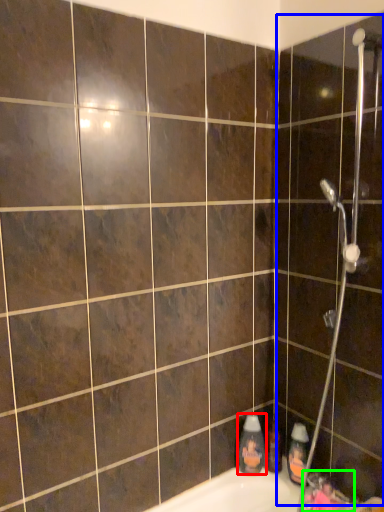
Question: Based on their relative distances, which object is farther from cleaning product (highlighted by a red box)? Choose from screen door (highlighted by a blue box) and faucet (highlighted by a green box).

Choices:
 (A) screen door
 (B) faucet

Answer: (A)